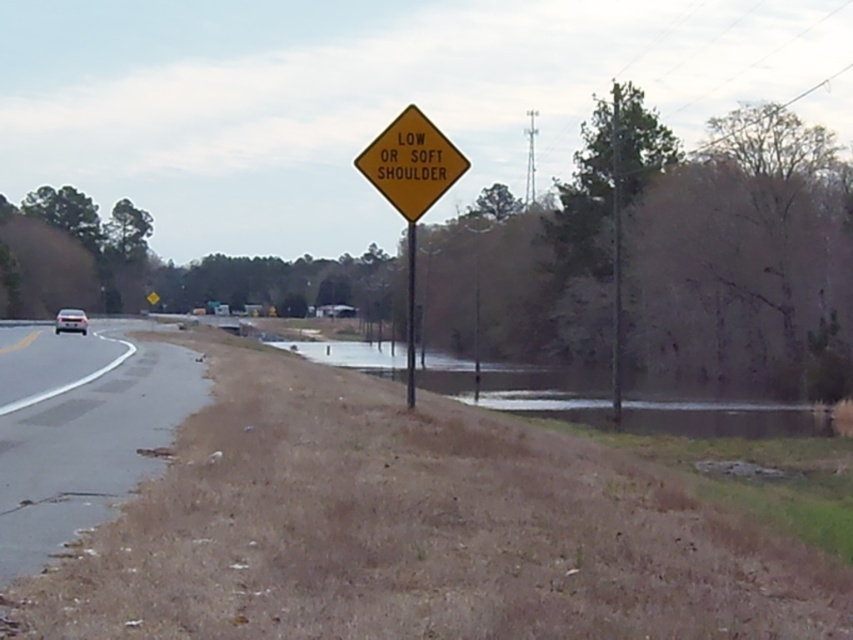
You are a surveyor measuring the location of the brown dirt at lower center in the image. What are the coordinates of this object?

The coordinates of the brown dirt at lower center are at point (x=715, y=412).

You are standing at the yellow warning sign on the roadside and want to walk to both the point at coordinates (68,422) and the point at (426,141). Which point will you reach first?

You will reach the point at coordinates (68,422) first because it is closer to you than the point at (426,141).